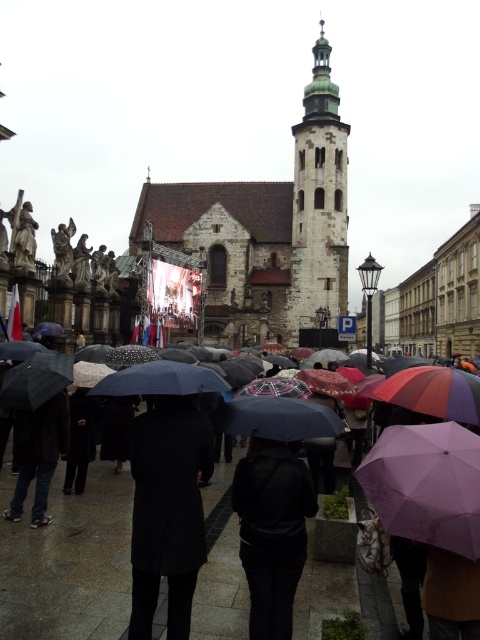
Can you confirm if black matte coat at center is positioned above black leather jacket at center?

Yes, black matte coat at center is above black leather jacket at center.

Between black matte coat at center and black leather jacket at center, which one appears on the left side from the viewer's perspective?

black matte coat at center

Is point (192, 496) behind point (284, 508)?

Yes, point (192, 496) is farther from viewer.

Identify the location of black matte coat at center. (168, 509).

Between matte black umbrella at center and white stone tower at center, which one appears on the left side from the viewer's perspective?

matte black umbrella at center is more to the left.

Is matte black umbrella at center wider than white stone tower at center?

Yes, matte black umbrella at center is wider than white stone tower at center.

The height and width of the screenshot is (640, 480). What do you see at coordinates (68, 561) in the screenshot?
I see `matte black umbrella at center` at bounding box center [68, 561].

Locate an element on the screen. This screenshot has height=640, width=480. matte black umbrella at center is located at coordinates (68, 561).

Is black matte coat at center bigger than purple matte umbrella at center?

Yes.

Which is above, black matte coat at center or purple matte umbrella at center?

purple matte umbrella at center

Image resolution: width=480 pixels, height=640 pixels. Describe the element at coordinates (168, 509) in the screenshot. I see `black matte coat at center` at that location.

Locate an element on the screen. The image size is (480, 640). black matte coat at center is located at coordinates (168, 509).